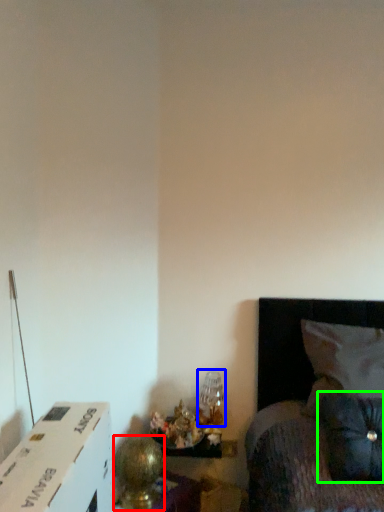
Question: Which object is the farthest from table lamp (highlighted by a red box)? Choose among these: table lamp (highlighted by a blue box) or pillow (highlighted by a green box).

Choices:
 (A) table lamp
 (B) pillow

Answer: (B)